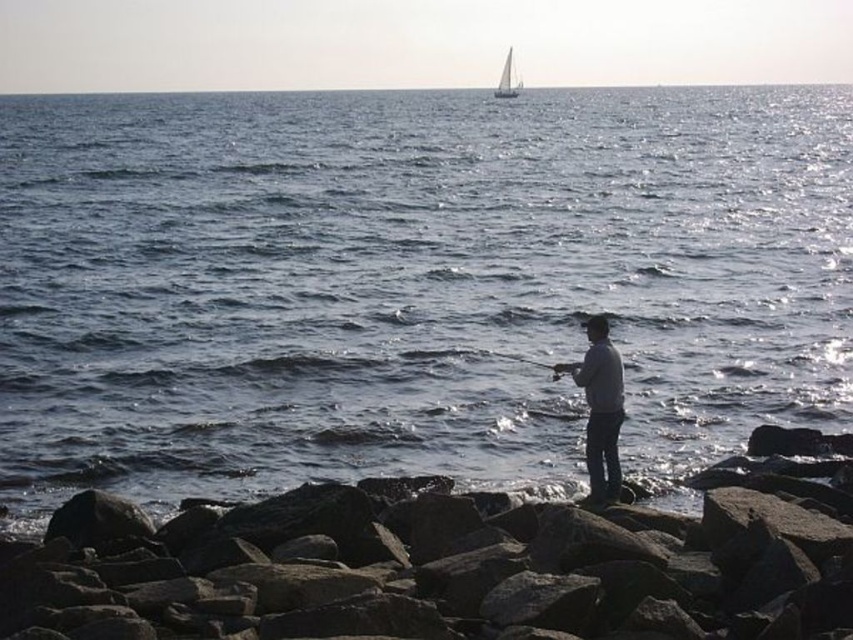
You are a photographer trying to capture the best angle of the coastal scene. You notice two points in the image labeled as point (833, 122) and point (585, 394). Based on their positions, which point is closer to your camera?

Point (833, 122) is further to the camera than point (585, 394), so the point closer to the camera is point (585, 394).

In the scene shown: You are standing on the rocky shoreline in the coastal scene. If you want to reach the blue water at center, in which direction should you move relative to your current position?

The blue water at center is located at point 0.444 on the x and 0.483 on the y coordinate, so you should move towards the center of the image to reach it.

You are a photographer trying to capture the scene of the blue water at center and the gray cotton shirt at center. Which object should you zoom in on to ensure it fills more of your camera frame?

The blue water at center is larger in size than the gray cotton shirt at center, so you should zoom in on the blue water at center to ensure it fills more of your camera frame.